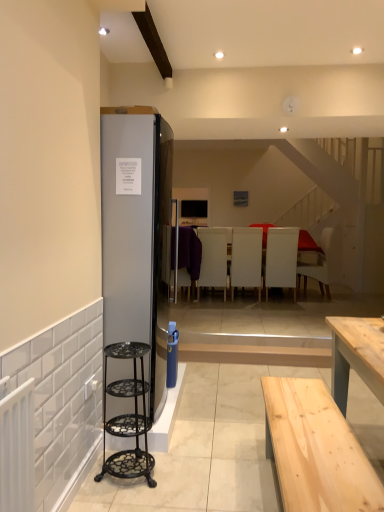
What is the approximate width of purple fabric armchair at center, the first armchair viewed from the left?

It is 41.38 centimeters.

Where is `satin silver refrigerator at left`? satin silver refrigerator at left is located at coordinates tap(136, 234).

The width and height of the screenshot is (384, 512). Describe the element at coordinates (246, 259) in the screenshot. I see `white leather armchair at center, the third armchair from the left` at that location.

Locate an element on the screen. white leather armchair at center, which appears as the fourth armchair when viewed from the left is located at coordinates (281, 258).

Describe the element at coordinates (213, 259) in the screenshot. Image resolution: width=384 pixels, height=512 pixels. I see `white leather armchair at center, which is the fourth armchair in right-to-left order` at that location.

Locate an element on the screen. The height and width of the screenshot is (512, 384). purple fabric armchair at center, the first armchair viewed from the left is located at coordinates (188, 256).

Based on the photo, in terms of height, does white leather armchair at center, the 3th armchair in the right-to-left sequence, look taller or shorter compared to white leather armchair at center, the 2th armchair from the left?

In the image, white leather armchair at center, the 3th armchair in the right-to-left sequence, appears to be shorter than white leather armchair at center, the 2th armchair from the left.

Considering the positions of objects white leather armchair at center, the third armchair from the left, and white leather armchair at center, which is the fourth armchair in right-to-left order, in the image provided, who is more to the left, white leather armchair at center, the third armchair from the left, or white leather armchair at center, which is the fourth armchair in right-to-left order,?

white leather armchair at center, which is the fourth armchair in right-to-left order, is more to the left.

Is white leather armchair at center, the 3th armchair in the right-to-left sequence, in contact with white leather armchair at center, which is the fourth armchair in right-to-left order?

No, white leather armchair at center, the 3th armchair in the right-to-left sequence, is not touching white leather armchair at center, which is the fourth armchair in right-to-left order.

Considering the positions of point (231, 268) and point (202, 247), is point (231, 268) closer or farther from the camera than point (202, 247)?

Point (231, 268) is positioned closer to the camera compared to point (202, 247).

Based on the photo, are white leather armchair at center, which is the fourth armchair in right-to-left order, and white fabric armchair at center, which is counted as the fifth armchair, starting from the left, located far from each other?

Yes.

Considering the relative sizes of white leather armchair at center, the 2th armchair from the left, and white fabric armchair at center, the 1th armchair when ordered from right to left, in the image provided, is white leather armchair at center, the 2th armchair from the left, taller than white fabric armchair at center, the 1th armchair when ordered from right to left,?

Yes, white leather armchair at center, the 2th armchair from the left, is taller than white fabric armchair at center, the 1th armchair when ordered from right to left.

Which is more to the right, white leather armchair at center, the 2th armchair from the left, or white fabric armchair at center, which is counted as the fifth armchair, starting from the left?

From the viewer's perspective, white fabric armchair at center, which is counted as the fifth armchair, starting from the left, appears more on the right side.

Is white leather armchair at center, which is the fourth armchair in right-to-left order, aimed at white fabric armchair at center, the 1th armchair when ordered from right to left?

No, white leather armchair at center, which is the fourth armchair in right-to-left order, is not turned towards white fabric armchair at center, the 1th armchair when ordered from right to left.

Between white leather armchair at center, which appears as the fourth armchair when viewed from the left, and purple fabric armchair at center, arranged as the fifth armchair when viewed from the right, which one has larger width?

white leather armchair at center, which appears as the fourth armchair when viewed from the left, is wider.

Which object is further away from the camera, white leather armchair at center, the second armchair positioned from the right, or purple fabric armchair at center, arranged as the fifth armchair when viewed from the right?

white leather armchair at center, the second armchair positioned from the right.

Is white leather armchair at center, the second armchair positioned from the right, oriented away from purple fabric armchair at center, the first armchair viewed from the left?

That's not correct — white leather armchair at center, the second armchair positioned from the right, is not looking away from purple fabric armchair at center, the first armchair viewed from the left.

Where is `the 3rd armchair above when counting from the white leather armchair at center, which appears as the fourth armchair when viewed from the left (from the image's perspective)`? The width and height of the screenshot is (384, 512). the 3rd armchair above when counting from the white leather armchair at center, which appears as the fourth armchair when viewed from the left (from the image's perspective) is located at coordinates (188, 256).

Measure the distance from purple fabric armchair at center, the first armchair viewed from the left, to white leather armchair at center, the second armchair positioned from the right.

A distance of 3.82 feet exists between purple fabric armchair at center, the first armchair viewed from the left, and white leather armchair at center, the second armchair positioned from the right.

Which is in front, purple fabric armchair at center, arranged as the fifth armchair when viewed from the right, or white leather armchair at center, the second armchair positioned from the right?

purple fabric armchair at center, arranged as the fifth armchair when viewed from the right, is closer to the camera.

Is purple fabric armchair at center, arranged as the fifth armchair when viewed from the right, taller or shorter than white leather armchair at center, which appears as the fourth armchair when viewed from the left?

In the image, purple fabric armchair at center, arranged as the fifth armchair when viewed from the right, appears to be shorter than white leather armchair at center, which appears as the fourth armchair when viewed from the left.

Is point (187, 233) farther from camera compared to point (296, 265)?

That is True.

From the purple fabric armchair at center, arranged as the fifth armchair when viewed from the right, count 3rd armchairs backward and point to it. Please provide its 2D coordinates.

[(213, 259)]

Is white leather armchair at center, which is the fourth armchair in right-to-left order, behind purple fabric armchair at center, arranged as the fifth armchair when viewed from the right?

Yes, white leather armchair at center, which is the fourth armchair in right-to-left order, is further from the viewer.

Is white leather armchair at center, which is the fourth armchair in right-to-left order, to the left of purple fabric armchair at center, the first armchair viewed from the left, from the viewer's perspective?

Incorrect, white leather armchair at center, which is the fourth armchair in right-to-left order, is not on the left side of purple fabric armchair at center, the first armchair viewed from the left.

Considering the points (222, 263) and (186, 261), which point is behind, point (222, 263) or point (186, 261)?

The point (222, 263) is more distant.

Is satin silver refrigerator at left wider than black wrought iron step stool at left?

Indeed, satin silver refrigerator at left has a greater width compared to black wrought iron step stool at left.

Between satin silver refrigerator at left and black wrought iron step stool at left, which one has smaller size?

Smaller between the two is black wrought iron step stool at left.

Considering the positions of objects satin silver refrigerator at left and black wrought iron step stool at left in the image provided, who is more to the left, satin silver refrigerator at left or black wrought iron step stool at left?

satin silver refrigerator at left.

In the image, there is a black wrought iron step stool at left. Where is `fridge above it (from the image's perspective)`? The width and height of the screenshot is (384, 512). fridge above it (from the image's perspective) is located at coordinates (136, 234).

What's the angular difference between white fabric armchair at center, the 1th armchair when ordered from right to left, and white leather armchair at center, the 3th armchair in the right-to-left sequence,'s facing directions?

There is a 87.5-degree angle between the facing directions of white fabric armchair at center, the 1th armchair when ordered from right to left, and white leather armchair at center, the 3th armchair in the right-to-left sequence.

Can you confirm if white fabric armchair at center, the 1th armchair when ordered from right to left, is thinner than white leather armchair at center, the third armchair from the left?

In fact, white fabric armchair at center, the 1th armchair when ordered from right to left, might be wider than white leather armchair at center, the third armchair from the left.

Consider the image. Can you confirm if white fabric armchair at center, which is counted as the fifth armchair, starting from the left, is bigger than white leather armchair at center, the third armchair from the left?

Correct, white fabric armchair at center, which is counted as the fifth armchair, starting from the left, is larger in size than white leather armchair at center, the third armchair from the left.

From a real-world perspective, relative to white leather armchair at center, the third armchair from the left, is white fabric armchair at center, which is counted as the fifth armchair, starting from the left, vertically above or below?

Clearly, from a real-world perspective, white fabric armchair at center, which is counted as the fifth armchair, starting from the left, is below white leather armchair at center, the third armchair from the left.

Find the location of a particular element. The image size is (384, 512). the 2nd armchair located beneath the white leather armchair at center, the third armchair from the left (from a real-world perspective) is located at coordinates (213, 259).

Find the location of a particular element. The height and width of the screenshot is (512, 384). armchair that is the 2nd object located above the white fabric armchair at center, the 1th armchair when ordered from right to left (from the image's perspective) is located at coordinates (213, 259).

From the image, which object appears to be farther from white fabric armchair at center, which is counted as the fifth armchair, starting from the left, satin silver refrigerator at left or white leather armchair at center, which is the fourth armchair in right-to-left order?

Based on the image, satin silver refrigerator at left appears to be further to white fabric armchair at center, which is counted as the fifth armchair, starting from the left.

Looking at the image, which one is located further to white leather armchair at center, the 2th armchair from the left, purple fabric armchair at center, arranged as the fifth armchair when viewed from the right, or white leather armchair at center, the second armchair positioned from the right?

white leather armchair at center, the second armchair positioned from the right, lies further to white leather armchair at center, the 2th armchair from the left, than the other object.

Considering their positions, is white leather armchair at center, which appears as the fourth armchair when viewed from the left, positioned closer to white fabric armchair at center, the 1th armchair when ordered from right to left, than white leather armchair at center, the third armchair from the left?

Based on the image, white leather armchair at center, which appears as the fourth armchair when viewed from the left, appears to be nearer to white fabric armchair at center, the 1th armchair when ordered from right to left.

Which object lies nearer to the anchor point purple fabric armchair at center, the first armchair viewed from the left, satin silver refrigerator at left or white leather armchair at center, the 3th armchair in the right-to-left sequence?

white leather armchair at center, the 3th armchair in the right-to-left sequence.

Based on their spatial positions, is purple fabric armchair at center, the first armchair viewed from the left, or white leather armchair at center, the 2th armchair from the left, closer to white leather armchair at center, the 3th armchair in the right-to-left sequence?

white leather armchair at center, the 2th armchair from the left, is closer to white leather armchair at center, the 3th armchair in the right-to-left sequence.

Which object lies nearer to the anchor point white leather armchair at center, which is the fourth armchair in right-to-left order, satin silver refrigerator at left or black wrought iron step stool at left?

satin silver refrigerator at left lies closer to white leather armchair at center, which is the fourth armchair in right-to-left order, than the other object.

Estimate the real-world distances between objects in this image. Which object is closer to white leather armchair at center, the 2th armchair from the left, satin silver refrigerator at left or white leather armchair at center, the second armchair positioned from the right?

white leather armchair at center, the second armchair positioned from the right, lies closer to white leather armchair at center, the 2th armchair from the left, than the other object.

Considering their positions, is white fabric armchair at center, which is counted as the fifth armchair, starting from the left, positioned further to white leather armchair at center, the third armchair from the left, than black wrought iron step stool at left?

The object further to white leather armchair at center, the third armchair from the left, is black wrought iron step stool at left.

The image size is (384, 512). I want to click on fridge located between black wrought iron step stool at left and purple fabric armchair at center, the first armchair viewed from the left, in the depth direction, so [136, 234].

Identify the location of fridge between black wrought iron step stool at left and white leather armchair at center, the 2th armchair from the left, from front to back. (x=136, y=234).

Where is `fridge located between black wrought iron step stool at left and white fabric armchair at center, which is counted as the fifth armchair, starting from the left, in the depth direction`? This screenshot has width=384, height=512. fridge located between black wrought iron step stool at left and white fabric armchair at center, which is counted as the fifth armchair, starting from the left, in the depth direction is located at coordinates (136, 234).

This screenshot has height=512, width=384. In order to click on fridge positioned between black wrought iron step stool at left and white leather armchair at center, the second armchair positioned from the right, from near to far in this screenshot , I will do `click(136, 234)`.